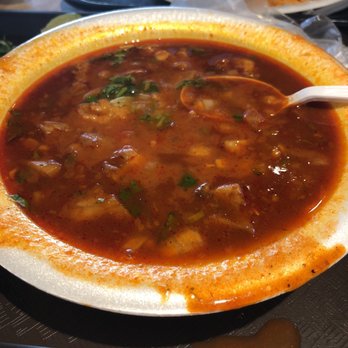
The width and height of the screenshot is (348, 348). I want to click on white indentations on edge of plate, so click(x=175, y=13), click(x=207, y=19).